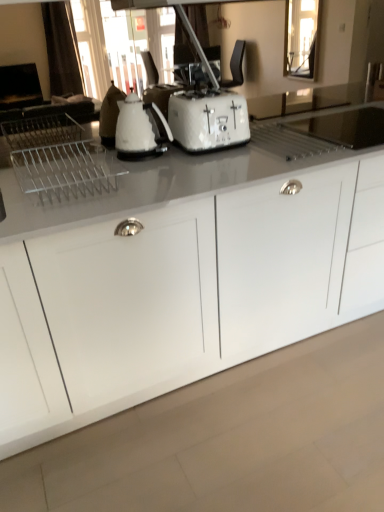
Question: Is the position of white glossy kettle at center less distant than that of white glossy cabinet at center?

Choices:
 (A) yes
 (B) no

Answer: (B)

Question: Is white glossy kettle at center facing towards white glossy cabinet at center?

Choices:
 (A) yes
 (B) no

Answer: (B)

Question: Is white glossy kettle at center to the left of white glossy cabinet at center from the viewer's perspective?

Choices:
 (A) no
 (B) yes

Answer: (B)

Question: From the image's perspective, is white glossy kettle at center above white glossy cabinet at center?

Choices:
 (A) no
 (B) yes

Answer: (B)

Question: Can you confirm if white glossy kettle at center is thinner than white glossy cabinet at center?

Choices:
 (A) yes
 (B) no

Answer: (A)

Question: Does point (34, 437) appear closer or farther from the camera than point (173, 104)?

Choices:
 (A) farther
 (B) closer

Answer: (B)

Question: In terms of height, does white glossy cabinet at center look taller or shorter compared to white textured toaster at center?

Choices:
 (A) short
 (B) tall

Answer: (B)

Question: Is white glossy cabinet at center in front of or behind white textured toaster at center in the image?

Choices:
 (A) behind
 (B) front

Answer: (B)

Question: From the image's perspective, is white glossy cabinet at center located above or below white textured toaster at center?

Choices:
 (A) above
 (B) below

Answer: (B)

Question: Do you think white textured toaster at center is within white glossy cabinet at center, or outside of it?

Choices:
 (A) inside
 (B) outside

Answer: (B)

Question: From their relative heights in the image, would you say white textured toaster at center is taller or shorter than white glossy cabinet at center?

Choices:
 (A) tall
 (B) short

Answer: (B)

Question: From a real-world perspective, is white textured toaster at center physically located above or below white glossy cabinet at center?

Choices:
 (A) above
 (B) below

Answer: (A)

Question: Would you say white textured toaster at center is to the left or to the right of white glossy cabinet at center in the picture?

Choices:
 (A) left
 (B) right

Answer: (A)

Question: In the image, is white glossy cabinet at center on the left side or the right side of white glossy kettle at center?

Choices:
 (A) left
 (B) right

Answer: (B)

Question: In terms of size, does white glossy cabinet at center appear bigger or smaller than white glossy kettle at center?

Choices:
 (A) big
 (B) small

Answer: (A)